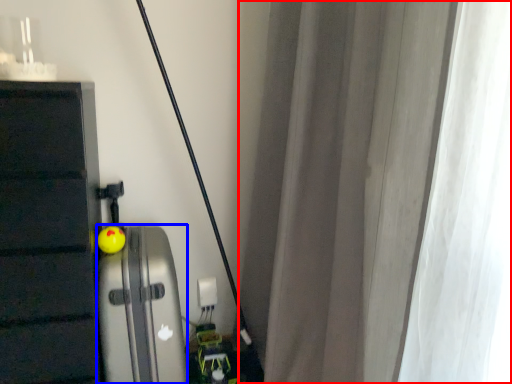
Question: Which object is further to the camera taking this photo, curtain (highlighted by a red box) or appliance (highlighted by a blue box)?

Choices:
 (A) curtain
 (B) appliance

Answer: (B)